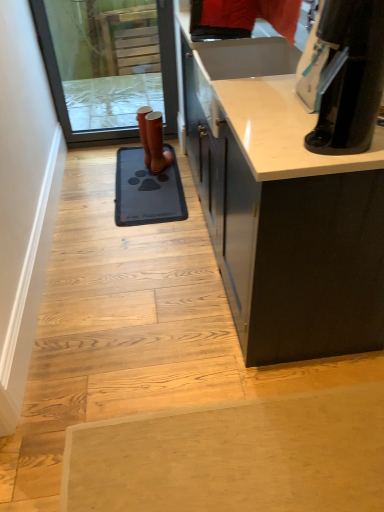
You are a GUI agent. You are given a task and a screenshot of the screen. Output one action in this format:
    pyautogui.click(x=<x>, y=<y>)
    Task: Click on the free space in front of brown leather boot at center
    The image size is (384, 512).
    Given the screenshot: What is the action you would take?
    pyautogui.click(x=169, y=177)